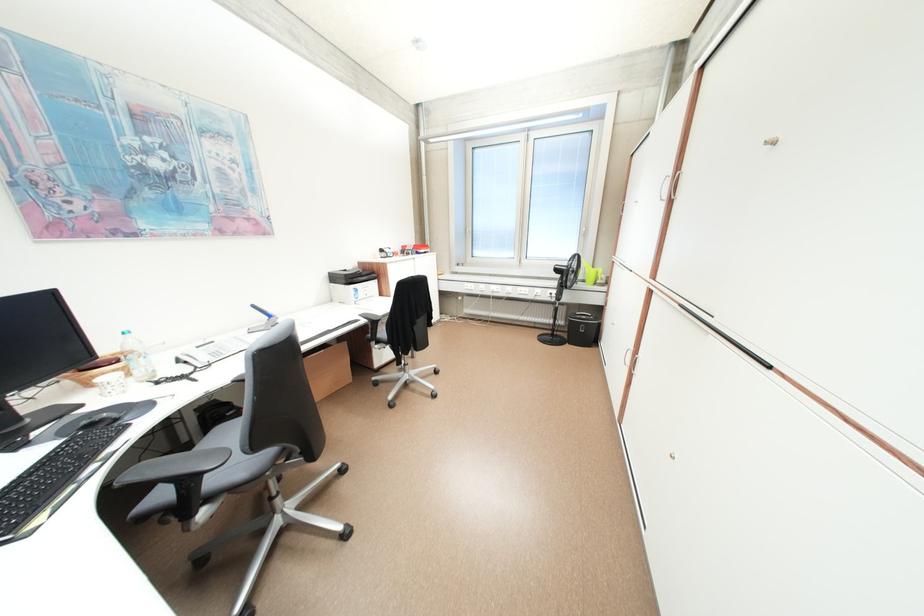
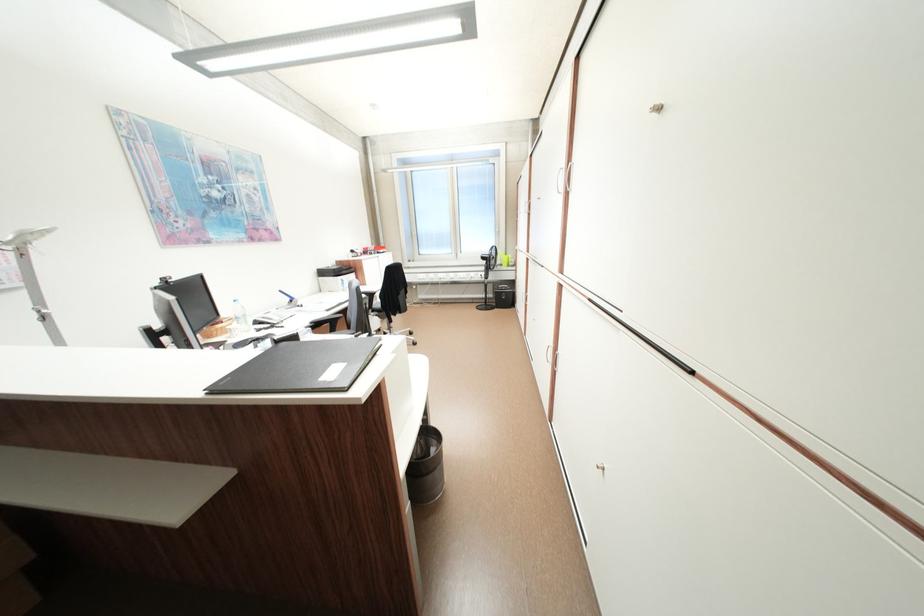
In the second image, find the point that corresponds to point 566,270 in the first image.

(492, 259)